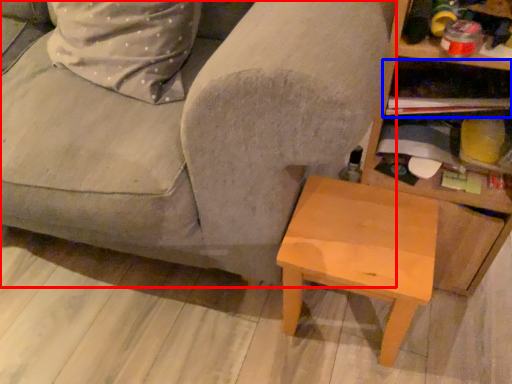
Question: Among these objects, which one is nearest to the camera, studio couch (highlighted by a red box) or shelf (highlighted by a blue box)?

Choices:
 (A) studio couch
 (B) shelf

Answer: (A)